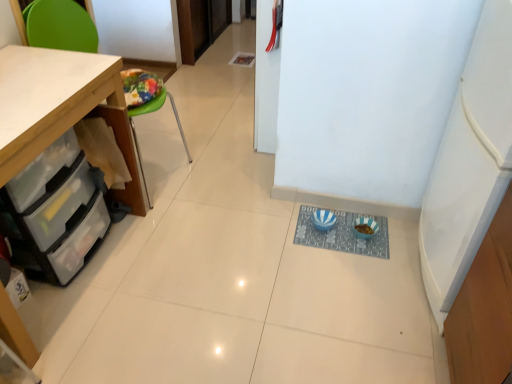
Where is `free point above blue striped bowls at center (from a real-world perspective)`? The image size is (512, 384). free point above blue striped bowls at center (from a real-world perspective) is located at coordinates click(x=341, y=230).